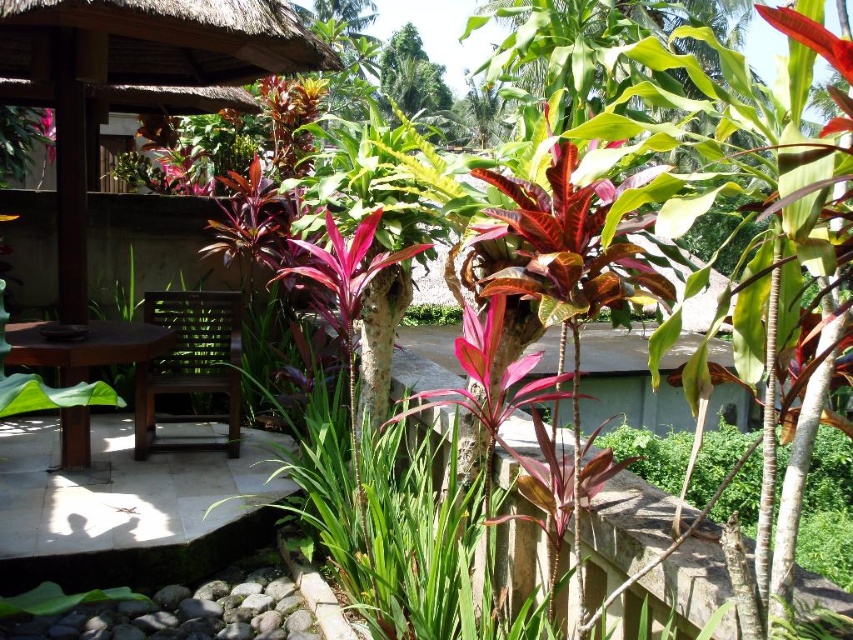
You are standing at the point with coordinates point (125, 321) and want to walk towards the wooden table and chair in the midground. Is the point (241, 326) located in front of or behind you?

Point (241, 326) is in front of point (125, 321), so it is located in front of you.

You are planning to place a new decorative pot that requires 1 meter of space. You have the brown wooden chair at center and the brown wooden table at lower left in the scene. Which object allows enough space for the pot?

The brown wooden table at lower left has a greater width than the brown wooden chair at center, so the decorative pot requiring 1 meter of space can fit next to the brown wooden table at lower left if its width meets or exceeds 1 meter. However, the chair might be too narrow.